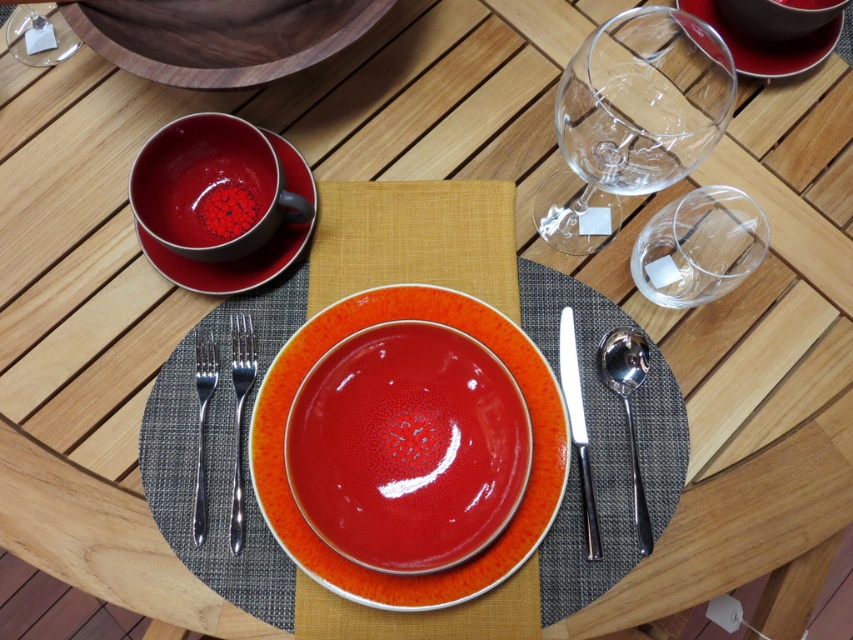
Between silver metallic fork at left and matte ceramic bowl at center, which one appears on the left side from the viewer's perspective?

silver metallic fork at left

Which is more to the right, silver metallic fork at left or matte ceramic bowl at center?

From the viewer's perspective, matte ceramic bowl at center appears more on the right side.

Who is more forward, (198, 464) or (793, 3)?

Point (198, 464) is in front.

Locate an element on the screen. The width and height of the screenshot is (853, 640). silver metallic fork at left is located at coordinates (202, 422).

Which of these two, textured gray placemat at center or satin silver spoon at right, stands shorter?

satin silver spoon at right is shorter.

Where is `textured gray placemat at center`? The image size is (853, 640). textured gray placemat at center is located at coordinates (229, 451).

Does point (300, 624) come farther from viewer compared to point (619, 330)?

No, it is not.

At what (x,y) coordinates should I click in order to perform the action: click on textured gray placemat at center. Please return your answer as a coordinate pair (x, y). This screenshot has width=853, height=640. Looking at the image, I should click on pos(229,451).

This screenshot has width=853, height=640. Describe the element at coordinates (636, 112) in the screenshot. I see `transparent glass wine glass at upper right` at that location.

Between transparent glass wine glass at upper right and wooden bowl at upper left, which one appears on the right side from the viewer's perspective?

transparent glass wine glass at upper right

Identify the location of transparent glass wine glass at upper right. This screenshot has height=640, width=853. (636, 112).